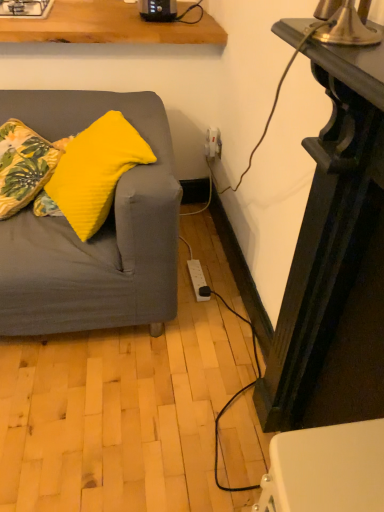
Question: Is white glossy gas stove at upper left not close to yellow fabric pillow at left, marked as the 2th pillow in a right-to-left arrangement?

Choices:
 (A) no
 (B) yes

Answer: (A)

Question: Does white glossy gas stove at upper left have a greater height compared to yellow fabric pillow at left, marked as the 2th pillow in a right-to-left arrangement?

Choices:
 (A) yes
 (B) no

Answer: (B)

Question: Can you confirm if white glossy gas stove at upper left is positioned to the left of yellow fabric pillow at left, marked as the 1th pillow in a left-to-right arrangement?

Choices:
 (A) no
 (B) yes

Answer: (B)

Question: Is white glossy gas stove at upper left facing towards yellow fabric pillow at left, marked as the 1th pillow in a left-to-right arrangement?

Choices:
 (A) yes
 (B) no

Answer: (B)

Question: Considering the relative positions of white glossy gas stove at upper left and yellow fabric pillow at left, marked as the 2th pillow in a right-to-left arrangement, in the image provided, is white glossy gas stove at upper left to the right of yellow fabric pillow at left, marked as the 2th pillow in a right-to-left arrangement, from the viewer's perspective?

Choices:
 (A) yes
 (B) no

Answer: (B)

Question: Considering their positions, is yellow fabric pillow at left, the 1th pillow when ordered from right to left, located in front of or behind black plastic toaster at upper center?

Choices:
 (A) front
 (B) behind

Answer: (A)

Question: Is yellow fabric pillow at left, which appears as the 2th pillow when viewed from the left, to the left or to the right of black plastic toaster at upper center in the image?

Choices:
 (A) left
 (B) right

Answer: (A)

Question: Looking at their shapes, would you say yellow fabric pillow at left, the 1th pillow when ordered from right to left, is wider or thinner than black plastic toaster at upper center?

Choices:
 (A) wide
 (B) thin

Answer: (A)

Question: Is yellow fabric pillow at left, which appears as the 2th pillow when viewed from the left, taller or shorter than black plastic toaster at upper center?

Choices:
 (A) short
 (B) tall

Answer: (B)

Question: Is black plastic toaster at upper center inside or outside of black glossy table at right?

Choices:
 (A) inside
 (B) outside

Answer: (B)

Question: Considering the positions of point (168, 9) and point (347, 250), is point (168, 9) closer or farther from the camera than point (347, 250)?

Choices:
 (A) closer
 (B) farther

Answer: (B)

Question: From the image's perspective, relative to black glossy table at right, is black plastic toaster at upper center above or below?

Choices:
 (A) above
 (B) below

Answer: (A)

Question: Considering the relative positions of black plastic toaster at upper center and black glossy table at right in the image provided, is black plastic toaster at upper center to the left or to the right of black glossy table at right?

Choices:
 (A) left
 (B) right

Answer: (A)

Question: In terms of size, does black plastic toaster at upper center appear bigger or smaller than white glossy gas stove at upper left?

Choices:
 (A) small
 (B) big

Answer: (A)

Question: Would you say black plastic toaster at upper center is inside or outside white glossy gas stove at upper left?

Choices:
 (A) outside
 (B) inside

Answer: (A)